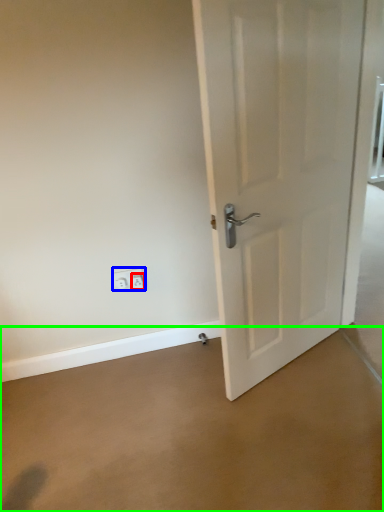
Question: Which object is the farthest from electric outlet (highlighted by a red box)? Choose among these: electric outlet (highlighted by a blue box) or concrete (highlighted by a green box).

Choices:
 (A) electric outlet
 (B) concrete

Answer: (B)